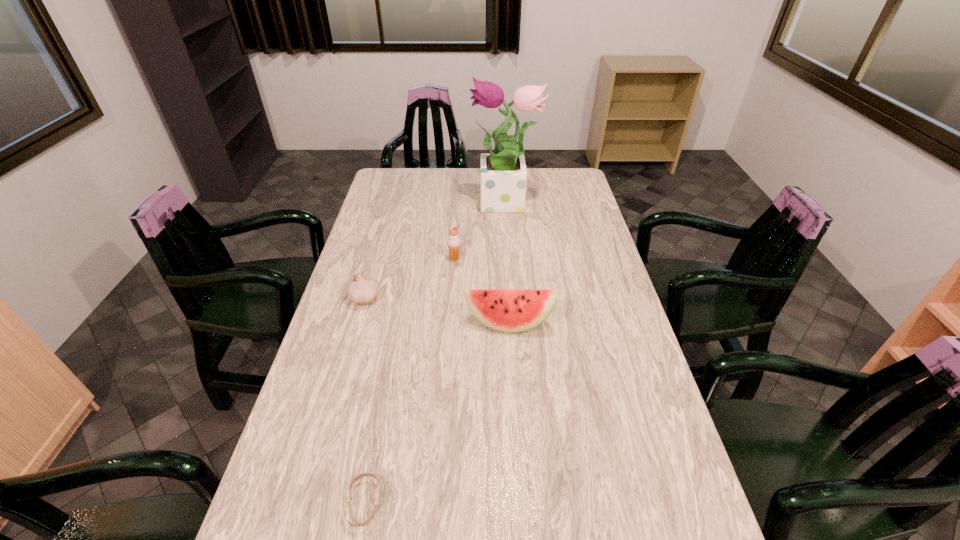
Identify which object is the third closest to the flower arrangement. Please provide its 2D coordinates. Your answer should be formatted as a tuple, i.e. [(x, y)], where the tuple contains the x and y coordinates of a point satisfying the conditions above.

[(506, 310)]

Select which object appears as the closest to the fourth farthest object. Please provide its 2D coordinates. Your answer should be formatted as a tuple, i.e. [(x, y)], where the tuple contains the x and y coordinates of a point satisfying the conditions above.

[(453, 242)]

Where is `vacant space that satisfies the following two spatial constraints: 1. on the front-facing side of the flower arrangement; 2. on the outer rind of the fourth farthest object`? vacant space that satisfies the following two spatial constraints: 1. on the front-facing side of the flower arrangement; 2. on the outer rind of the fourth farthest object is located at coordinates (514, 323).

In order to click on free spot that satisfies the following two spatial constraints: 1. at the front with a straw on the icecream; 2. on the face of the watch in this screenshot , I will do `click(438, 503)`.